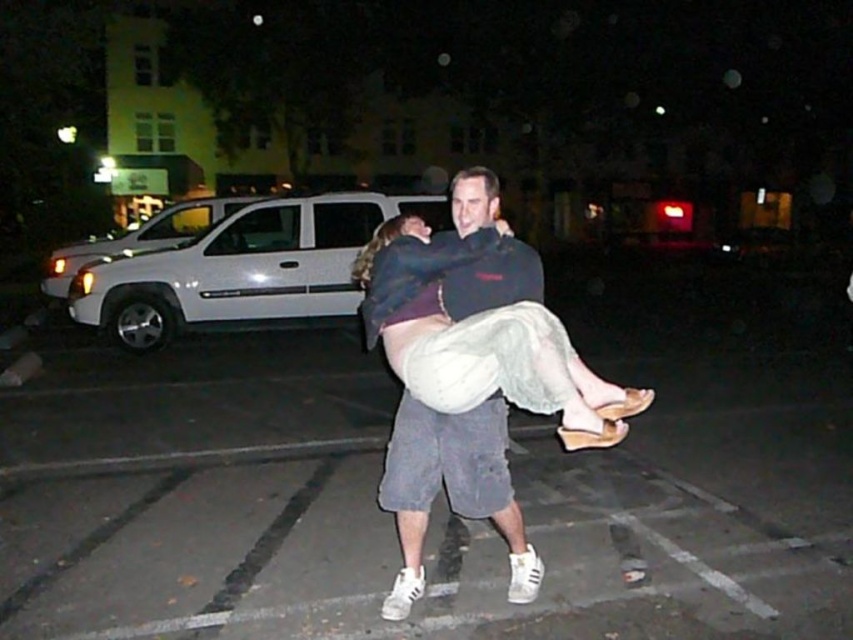
You are standing at the edge of the gray asphalt parking lot at center and want to walk towards the white matte suv at left. Which direction should you face to move directly towards it?

You should face to the left because the gray asphalt parking lot at center is to the right of the white matte suv at left, meaning the suv is located to your left side.

You are standing in the parking lot and want to walk to the white matte suv at left. Which direction should you move relative to the gray asphalt parking lot at center?

The gray asphalt parking lot at center is in front of the white matte suv at left, so to reach the white matte suv at left, you should move towards the area behind the gray asphalt parking lot at center.

You are standing in a dark parking lot and see a point at coordinates (132, 305). If the camera is 1.5 meters above the ground, can you estimate how far the point is from the ground level?

The point at coordinates (132, 305) is 9.79 meters away from the camera. Since the camera is 1.5 meters above the ground, the point is approximately 9.79 meters away from the camera, but the exact height from the ground cannot be determined without additional information about the point.